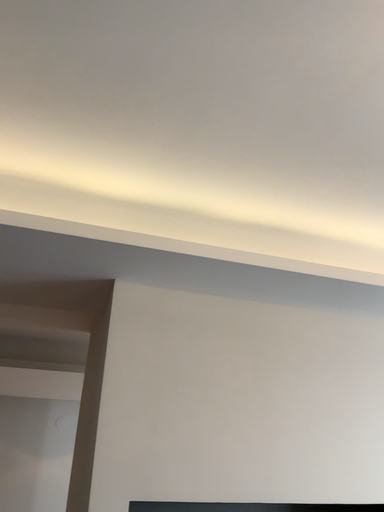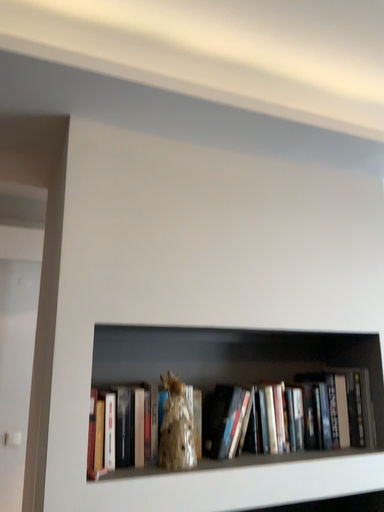
Question: How did the camera likely rotate when shooting the video?

Choices:
 (A) rotated downward
 (B) rotated upward

Answer: (A)